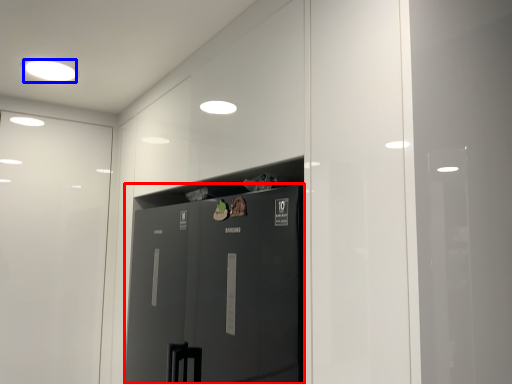
Question: Which point is further to the camera, door (highlighted by a red box) or lighting (highlighted by a blue box)?

Choices:
 (A) door
 (B) lighting

Answer: (B)